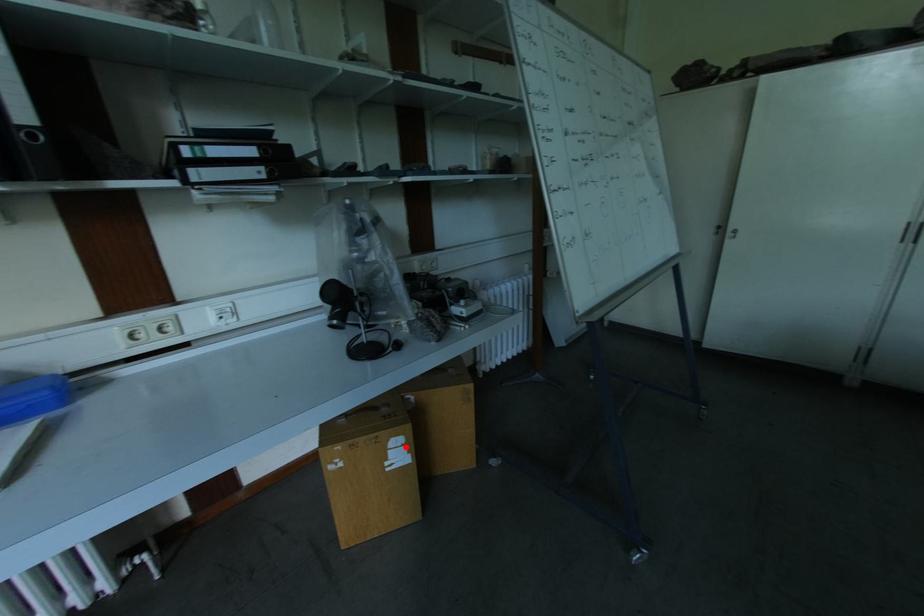
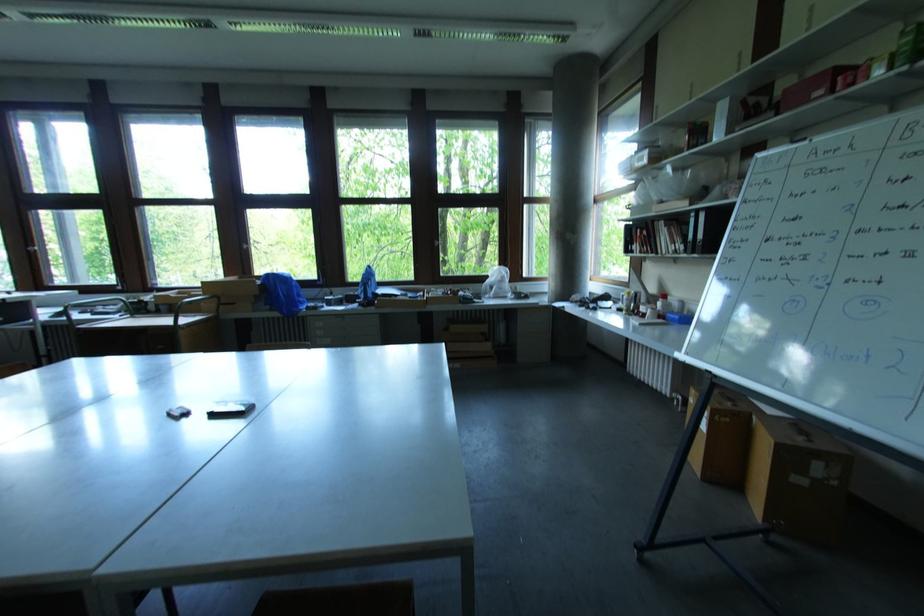
Question: I am providing you with two images of the same scene from different viewpoints. In image1, a red point is highlighted. Considering the same 3D point in image2, which of the following is correct?

Choices:
 (A) It is closer
 (B) It is farther

Answer: (A)